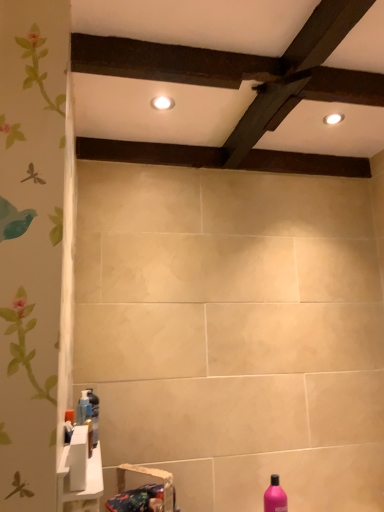
Question: Considering the relative positions of blue fabric sink at lower left, the second sink viewed from the top, and translucent plastic bottle at lower left, marked as the 1th bottle in a left-to-right arrangement, in the image provided, is blue fabric sink at lower left, the second sink viewed from the top, to the left of translucent plastic bottle at lower left, marked as the 1th bottle in a left-to-right arrangement, from the viewer's perspective?

Choices:
 (A) yes
 (B) no

Answer: (B)

Question: Is blue fabric sink at lower left, which appears as the 1th sink when ordered from the bottom, positioned beyond the bounds of translucent plastic bottle at lower left, the 2th bottle viewed from the right?

Choices:
 (A) yes
 (B) no

Answer: (A)

Question: Considering the relative sizes of blue fabric sink at lower left, the second sink viewed from the top, and translucent plastic bottle at lower left, which is the first bottle in top-to-bottom order, in the image provided, is blue fabric sink at lower left, the second sink viewed from the top, smaller than translucent plastic bottle at lower left, which is the first bottle in top-to-bottom order,?

Choices:
 (A) yes
 (B) no

Answer: (B)

Question: Is blue fabric sink at lower left, which appears as the 1th sink when ordered from the bottom, far from translucent plastic bottle at lower left, the second bottle positioned from the bottom?

Choices:
 (A) no
 (B) yes

Answer: (A)

Question: From a real-world perspective, is blue fabric sink at lower left, the second sink viewed from the top, beneath translucent plastic bottle at lower left, the second bottle positioned from the bottom?

Choices:
 (A) no
 (B) yes

Answer: (B)

Question: Is point (336, 114) closer or farther from the camera than point (264, 162)?

Choices:
 (A) closer
 (B) farther

Answer: (A)

Question: Based on their positions, is white glossy light fixture at upper right, which is the 2th lighting in front-to-back order, located to the left or right of dark brown wood at upper center?

Choices:
 (A) left
 (B) right

Answer: (B)

Question: From a real-world perspective, is white glossy light fixture at upper right, the first lighting positioned from the right, positioned above or below dark brown wood at upper center?

Choices:
 (A) below
 (B) above

Answer: (B)

Question: Considering the positions of white glossy light fixture at upper right, the first lighting positioned from the right, and dark brown wood at upper center in the image, is white glossy light fixture at upper right, the first lighting positioned from the right, wider or thinner than dark brown wood at upper center?

Choices:
 (A) wide
 (B) thin

Answer: (B)

Question: From their relative heights in the image, would you say white glossy light fixture at upper right, acting as the 1th lighting starting from the back, is taller or shorter than translucent plastic bottle at lower left, the second bottle positioned from the bottom?

Choices:
 (A) short
 (B) tall

Answer: (A)

Question: Considering the positions of white glossy light fixture at upper right, which is the 2th lighting in front-to-back order, and translucent plastic bottle at lower left, marked as the 1th bottle in a left-to-right arrangement, in the image, is white glossy light fixture at upper right, which is the 2th lighting in front-to-back order, bigger or smaller than translucent plastic bottle at lower left, marked as the 1th bottle in a left-to-right arrangement,?

Choices:
 (A) small
 (B) big

Answer: (A)

Question: Relative to translucent plastic bottle at lower left, the 2th bottle viewed from the right, is white glossy light fixture at upper right, acting as the 1th lighting starting from the back, in front or behind?

Choices:
 (A) front
 (B) behind

Answer: (B)

Question: Is white glossy light fixture at upper right, the 2th lighting positioned from the left, wider or thinner than translucent plastic bottle at lower left, the 2th bottle viewed from the right?

Choices:
 (A) thin
 (B) wide

Answer: (B)

Question: Which is correct: white glossy sink at lower left, arranged as the 2th sink when ordered from the bottom, is inside dark brown wood at upper center, or outside of it?

Choices:
 (A) outside
 (B) inside

Answer: (A)

Question: Is point (99, 480) positioned closer to the camera than point (271, 165)?

Choices:
 (A) closer
 (B) farther

Answer: (A)